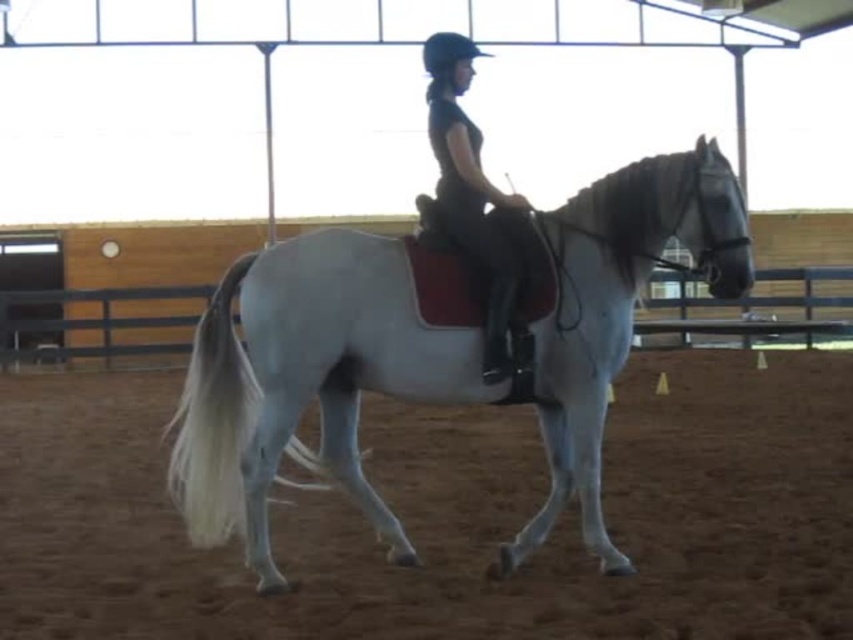
You are a photographer planning to take a photo of the scene. You want to ensure the white glossy horse at center and the black leather pants at center are both clearly visible. Which object should you focus on first to ensure both are in focus?

The white glossy horse at center is positioned under black leather pants at center. To ensure both are in focus, you should focus on the white glossy horse at center first since it is closer to the camera, and the black leather pants at center will naturally be in focus as they are behind it.

You are a rider in the indoor arena and want to move from your current position to the exit located at point (515, 288). There is an obstacle at point (149, 444). Can you safely navigate around the obstacle to reach the exit?

Point (149, 444) is behind point (515, 288), so the obstacle is located behind the exit. Therefore, you can safely navigate to the exit without encountering the obstacle first.

You are a rider who needs to adjust your position on the horse to ensure safety. Given that the distance between the white glossy horse at center and the black leather pants at center is critical for proper alignment, can you safely move closer to the horse without causing discomfort? Please consider the distance provided.

The white glossy horse at center is 28.76 inches away from the black leather pants at center. Since this distance is sufficient for proper riding posture and alignment, you can safely adjust your position without causing discomfort to the horse.